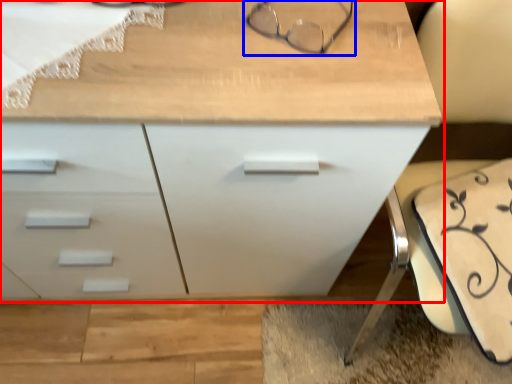
Question: Which point is further to the camera, chest of drawers (highlighted by a red box) or glasses (highlighted by a blue box)?

Choices:
 (A) chest of drawers
 (B) glasses

Answer: (B)